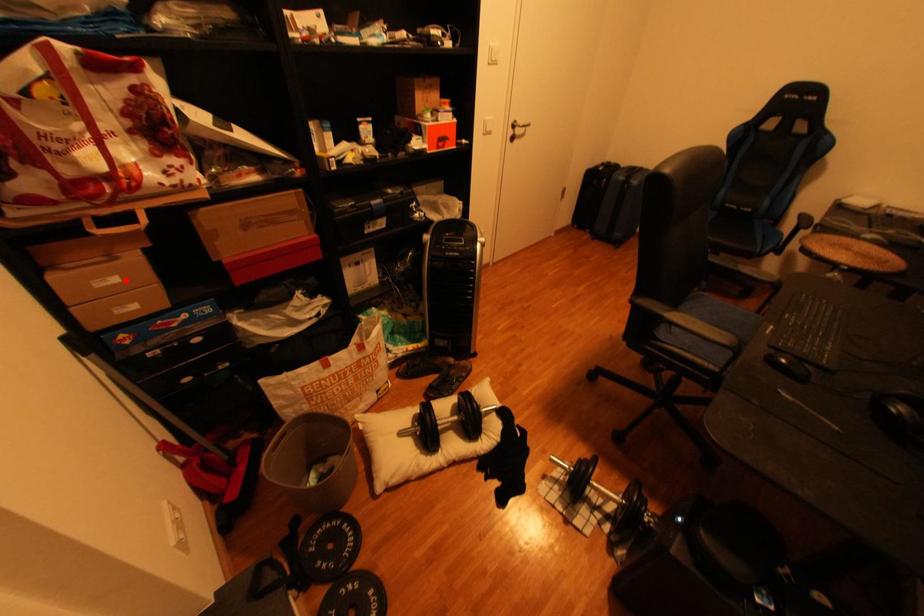
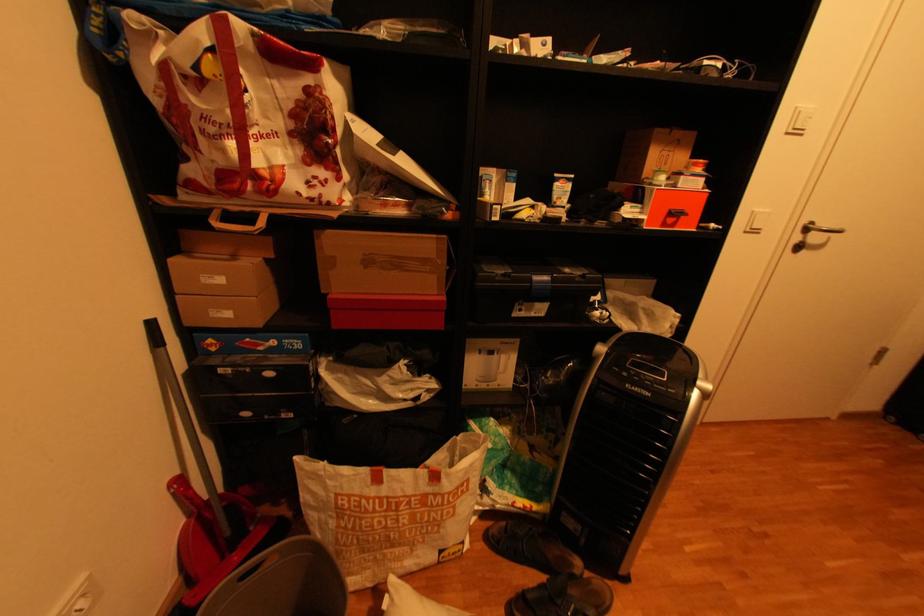
Find the pixel in the second image that matches the highlighted location in the first image.

(231, 281)